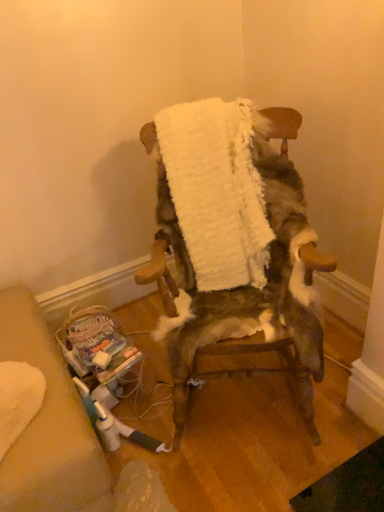
Question: In terms of height, does white fluffy blanket at center look taller or shorter compared to wooden rocking chair at center?

Choices:
 (A) tall
 (B) short

Answer: (B)

Question: Looking at the image, does white fluffy blanket at center seem bigger or smaller compared to wooden rocking chair at center?

Choices:
 (A) small
 (B) big

Answer: (A)

Question: From the image's perspective, relative to wooden rocking chair at center, is white fluffy blanket at center above or below?

Choices:
 (A) above
 (B) below

Answer: (A)

Question: From their relative heights in the image, would you say wooden rocking chair at center is taller or shorter than white fluffy blanket at center?

Choices:
 (A) short
 (B) tall

Answer: (B)

Question: In terms of size, does wooden rocking chair at center appear bigger or smaller than white fluffy blanket at center?

Choices:
 (A) big
 (B) small

Answer: (A)

Question: Is point (301, 246) closer or farther from the camera than point (261, 258)?

Choices:
 (A) farther
 (B) closer

Answer: (B)

Question: Relative to white fluffy blanket at center, is wooden rocking chair at center in front or behind?

Choices:
 (A) front
 (B) behind

Answer: (A)